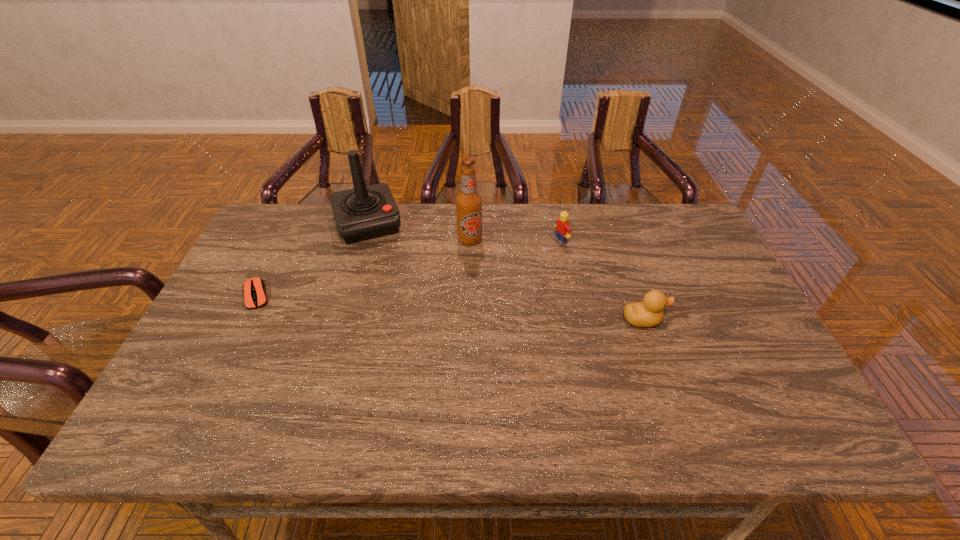
Locate an element on the screen. object that is positioned at the left edge is located at coordinates (254, 289).

In the image, there is a desktop. Find the location of `vacant space at the far edge`. vacant space at the far edge is located at coordinates (451, 222).

Find the location of a particular element. vacant space at the near edge of the desktop is located at coordinates (550, 392).

Find the location of a particular element. The height and width of the screenshot is (540, 960). blank space at the left edge of the desktop is located at coordinates (279, 294).

Where is `vacant space at the far left corner of the desktop`? The width and height of the screenshot is (960, 540). vacant space at the far left corner of the desktop is located at coordinates (269, 248).

Where is `free area in between the beer bottle and the duckling`? This screenshot has height=540, width=960. free area in between the beer bottle and the duckling is located at coordinates (557, 280).

Locate an element on the screen. The height and width of the screenshot is (540, 960). free space between the fourth object from right to left and the duckling is located at coordinates (506, 272).

I want to click on free space between the beer bottle and the joystick, so click(x=419, y=232).

This screenshot has width=960, height=540. I want to click on unoccupied area between the rightmost object and the joystick, so click(506, 272).

In order to click on free space that is in between the second object from left to right and the rightmost object in this screenshot , I will do `click(506, 272)`.